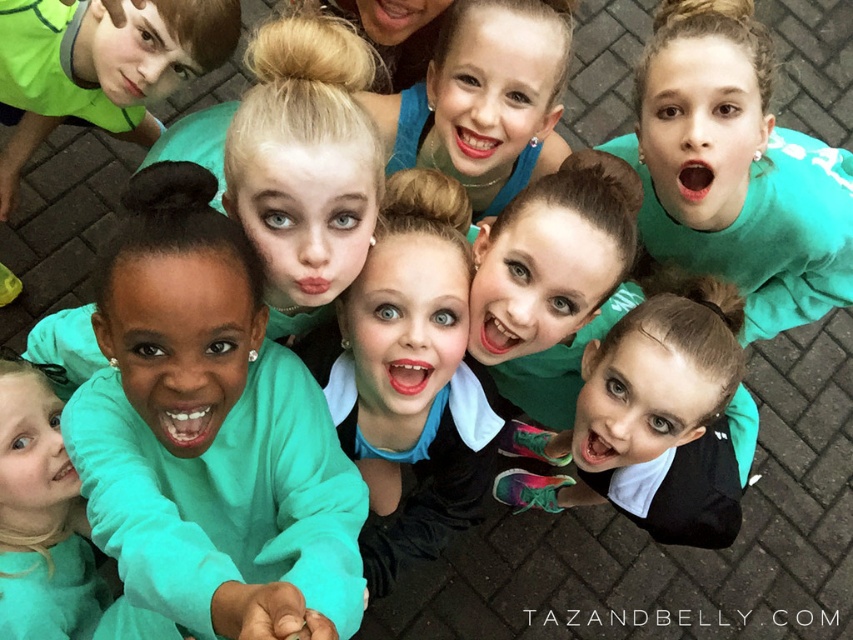
Consider the image. You are a photographer trying to capture a group photo of the children wearing teal fleece sweatshirts. You notice two teal fleece sweatshirts in the scene. Which one is positioned closer to the camera, the teal fleece sweatshirt at center or the teal fleece sweatshirt at upper left?

The teal fleece sweatshirt at center is closer to the viewer than the teal fleece sweatshirt at upper left, so the one at center would appear closer to the camera.